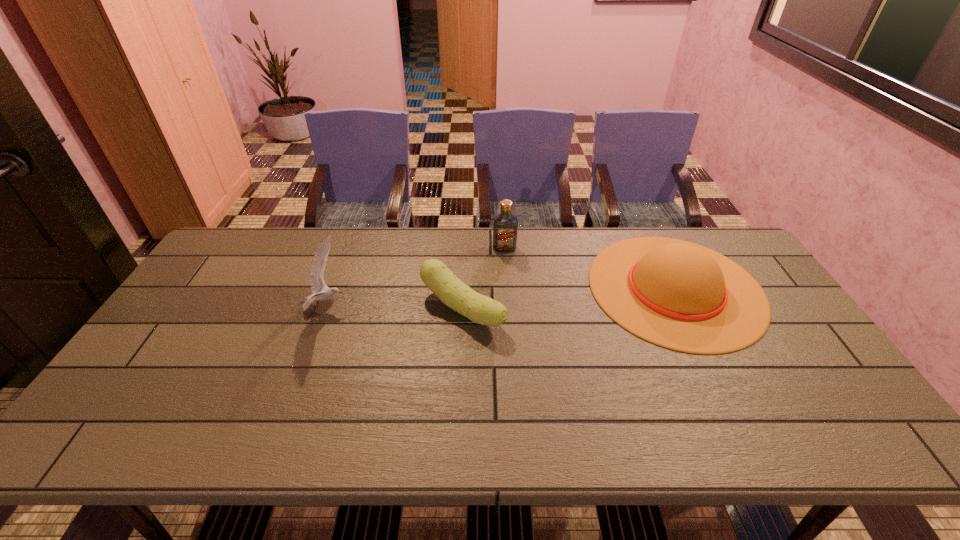
Identify the location of free space between the rightmost object and the cucumber. (569, 299).

At what (x,y) coordinates should I click in order to perform the action: click on empty space between the vodka and the leftmost object. Please return your answer as a coordinate pair (x, y). Image resolution: width=960 pixels, height=540 pixels. Looking at the image, I should click on (415, 278).

In order to click on vacant space that is in between the sombrero and the shortest object in this screenshot , I will do `click(569, 299)`.

Locate an element on the screen. The width and height of the screenshot is (960, 540). vacant space in between the sombrero and the gull is located at coordinates (500, 298).

Find the location of `free point between the vodka and the cucumber`. free point between the vodka and the cucumber is located at coordinates (484, 279).

The width and height of the screenshot is (960, 540). I want to click on vacant area between the vodka and the gull, so 415,278.

This screenshot has height=540, width=960. Identify the location of free space between the cucumber and the vodka. (484, 279).

The width and height of the screenshot is (960, 540). Identify the location of the closest object to the vodka. point(455,294).

The image size is (960, 540). I want to click on object that stands as the closest to the vodka, so click(x=455, y=294).

Image resolution: width=960 pixels, height=540 pixels. Find the location of `blank space that satisfies the following two spatial constraints: 1. at the tip of the beak of the leftmost object; 2. on the right side of the shortest object`. blank space that satisfies the following two spatial constraints: 1. at the tip of the beak of the leftmost object; 2. on the right side of the shortest object is located at coordinates click(x=324, y=309).